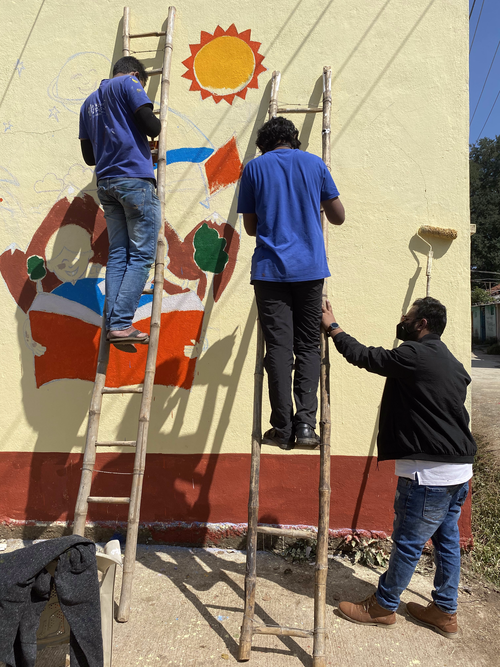
The image size is (500, 667). What are the coordinates of `paint roller` in the screenshot? It's located at (428, 269).